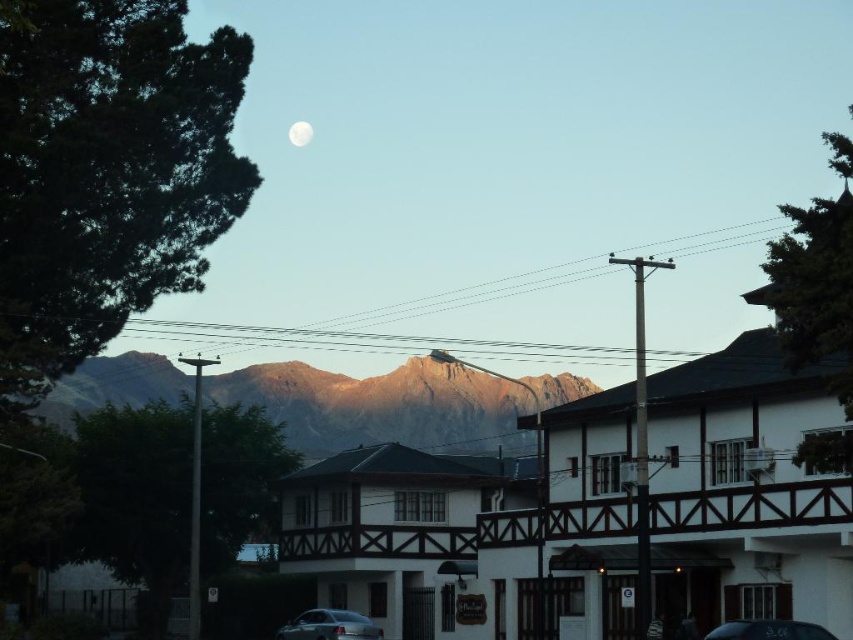
Is white wooden hotel at center further to camera compared to shiny black car at lower center?

No, white wooden hotel at center is closer to the viewer.

Is white wooden hotel at center above shiny black car at lower center?

Yes, white wooden hotel at center is above shiny black car at lower center.

Is point (807, 580) farther from camera compared to point (805, 625)?

Yes, it is.

Locate an element on the screen. This screenshot has width=853, height=640. white wooden hotel at center is located at coordinates (747, 490).

Which is above, white wooden hotel at center or white matte moon at upper center?

white matte moon at upper center

Is white wooden hotel at center bigger than white matte moon at upper center?

Yes.

Where is `white wooden hotel at center`? This screenshot has height=640, width=853. white wooden hotel at center is located at coordinates (747, 490).

Who is shorter, rugged brown mountain at center or white matte moon at upper center?

With less height is white matte moon at upper center.

Is point (577, 392) positioned after point (310, 132)?

No, it is in front of (310, 132).

Does point (103, 365) come closer to viewer compared to point (289, 140)?

Yes, point (103, 365) is in front of point (289, 140).

In order to click on rugged brown mountain at center in this screenshot , I will do `click(381, 406)`.